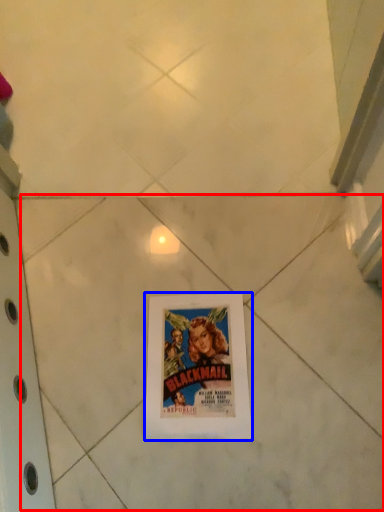
Question: Which object appears farthest to the camera in this image, tile (highlighted by a red box) or picture frame (highlighted by a blue box)?

Choices:
 (A) tile
 (B) picture frame

Answer: (B)